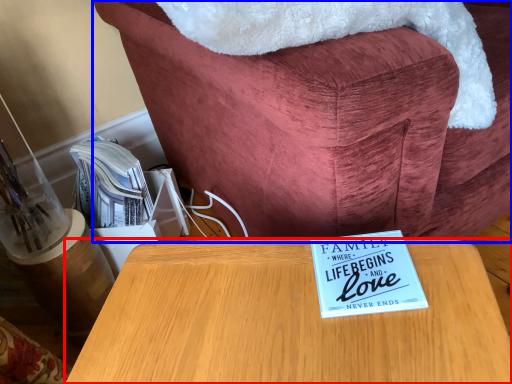
Question: Which point is closer to the camera, table (highlighted by a red box) or furniture (highlighted by a blue box)?

Choices:
 (A) table
 (B) furniture

Answer: (A)